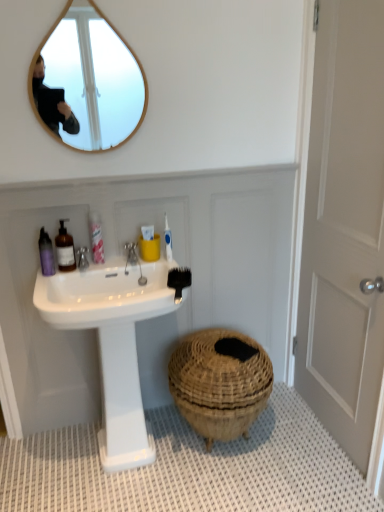
Locate an element on the screen. This screenshot has height=512, width=384. empty space that is in between white matte door at right and brown woven basket at lower center is located at coordinates [285, 450].